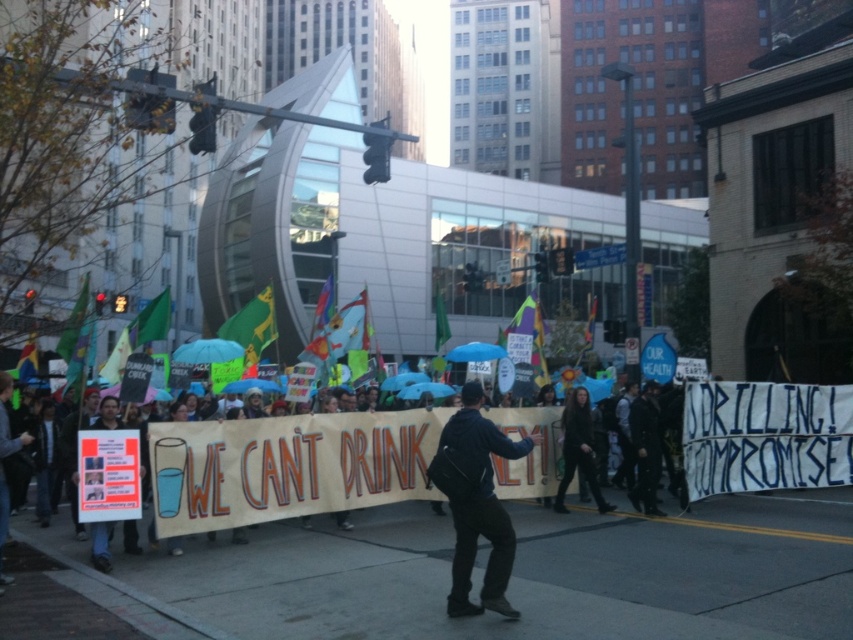
In order to click on brown cardboard banner at center in this screenshot , I will do `click(288, 465)`.

Does point (210, 486) come behind point (451, 483)?

Yes, point (210, 486) is behind point (451, 483).

I want to click on brown cardboard banner at center, so click(288, 465).

Looking at this image, is the position of dark blue jacket at center less distant than that of black leather jacket at center?

Yes, it is.

Can you confirm if dark blue jacket at center is thinner than black leather jacket at center?

No, dark blue jacket at center is not thinner than black leather jacket at center.

You are a GUI agent. You are given a task and a screenshot of the screen. Output one action in this format:
    pyautogui.click(x=<x>, y=<y>)
    Task: Click on the dark blue jacket at center
    This screenshot has width=853, height=640.
    Given the screenshot: What is the action you would take?
    (476, 502)

Does brown cardboard banner at center have a larger size compared to black leather jacket at center?

Correct, brown cardboard banner at center is larger in size than black leather jacket at center.

This screenshot has height=640, width=853. Find the location of `brown cardboard banner at center`. brown cardboard banner at center is located at coordinates (288, 465).

Locate an element on the screen. This screenshot has height=640, width=853. brown cardboard banner at center is located at coordinates (288, 465).